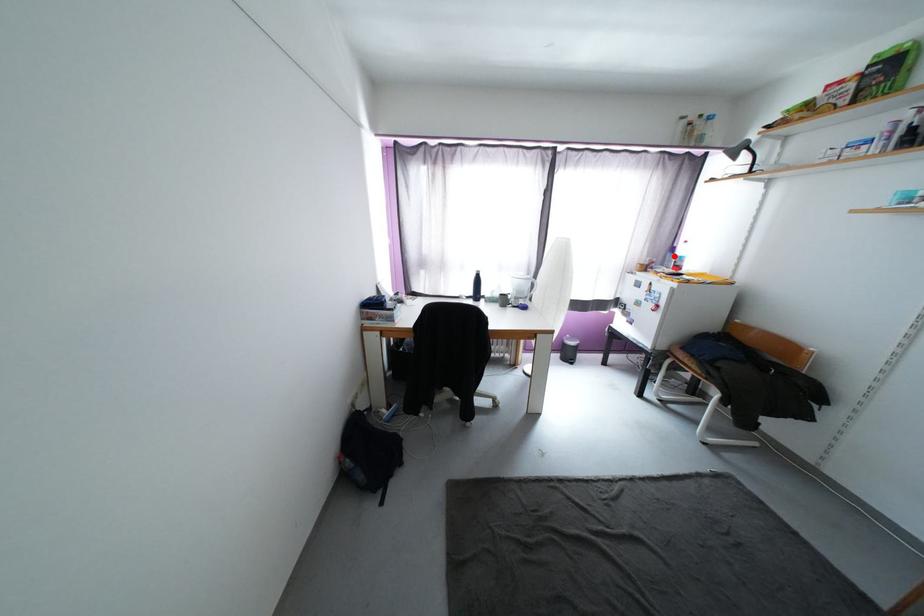
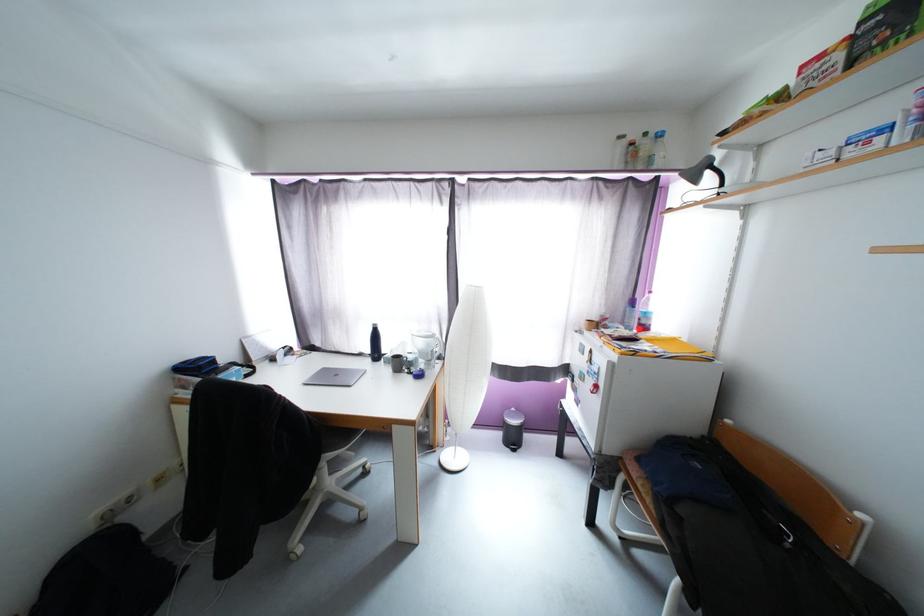
Question: I am providing you with two images of the same scene from different viewpoints. Image1 has a red point marked. In image2, the corresponding 3D location appears at what relative position? Reply with the corresponding letter.

Choices:
 (A) Closer
 (B) Farther

Answer: (B)